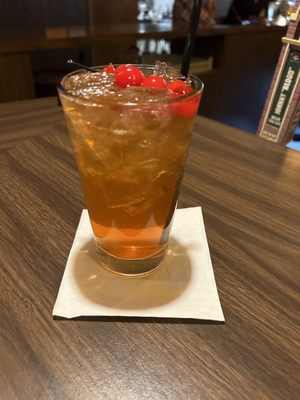
Where is `glass`? This screenshot has height=400, width=300. glass is located at coordinates (175, 100).